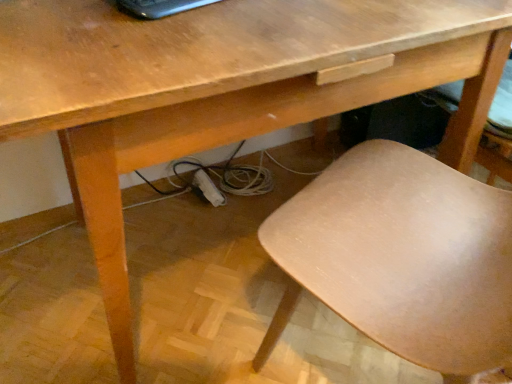
This screenshot has height=384, width=512. I want to click on vacant area that is in front of black glossy laptop at upper center, so click(x=189, y=36).